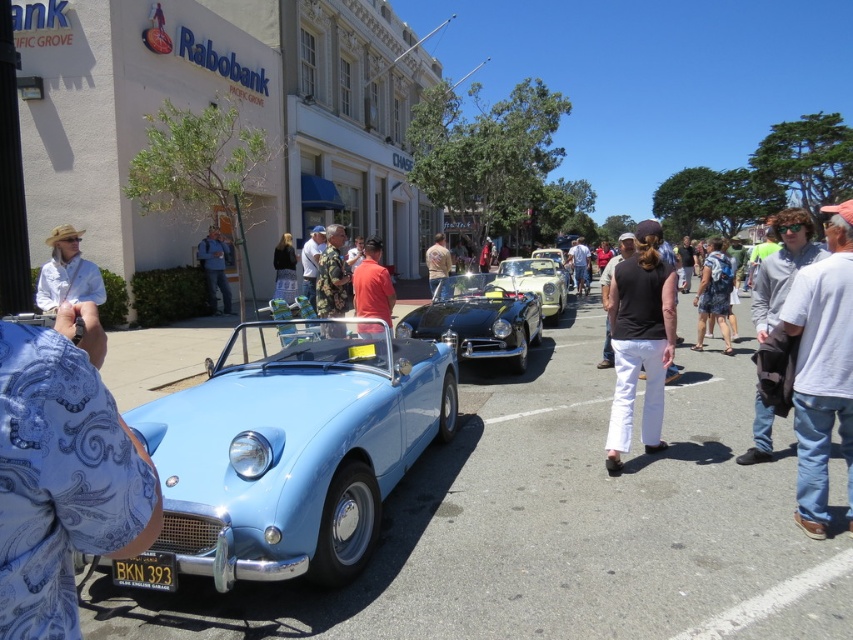
Between black cotton shirt at center and black leather jacket at center, which one has more height?

With more height is black cotton shirt at center.

This screenshot has height=640, width=853. I want to click on black cotton shirt at center, so click(614, 264).

The image size is (853, 640). Identify the location of black cotton shirt at center. (614, 264).

Which of these two, camouflage fabric jacket at center or blue denim jeans at center, stands shorter?

With less height is camouflage fabric jacket at center.

Is the position of camouflage fabric jacket at center less distant than that of blue denim jeans at center?

Yes, it is in front of blue denim jeans at center.

Where is `camouflage fabric jacket at center`? Image resolution: width=853 pixels, height=640 pixels. camouflage fabric jacket at center is located at coordinates (331, 275).

Identify the location of camouflage fabric jacket at center. The height and width of the screenshot is (640, 853). (331, 275).

Measure the distance between metallic gold car at center and white cotton shirt at center.

metallic gold car at center and white cotton shirt at center are 8.14 meters apart.

This screenshot has height=640, width=853. In order to click on metallic gold car at center in this screenshot , I will do `click(535, 282)`.